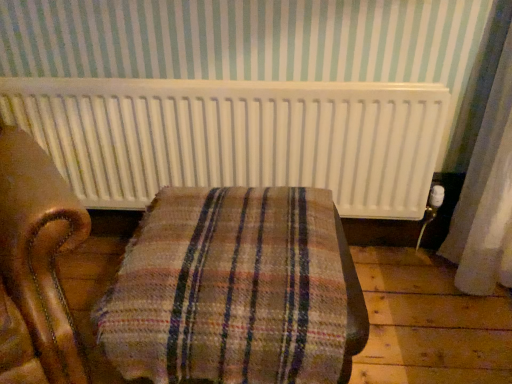
Question: In the image, is white matte radiator at upper center positioned in front of or behind plaid fabric ottoman at center?

Choices:
 (A) behind
 (B) front

Answer: (A)

Question: Is white matte radiator at upper center wider or thinner than plaid fabric ottoman at center?

Choices:
 (A) wide
 (B) thin

Answer: (B)

Question: Is white matte radiator at upper center taller or shorter than plaid fabric ottoman at center?

Choices:
 (A) short
 (B) tall

Answer: (A)

Question: Considering the positions of plaid fabric ottoman at center and white matte radiator at upper center in the image, is plaid fabric ottoman at center bigger or smaller than white matte radiator at upper center?

Choices:
 (A) big
 (B) small

Answer: (A)

Question: From a real-world perspective, is plaid fabric ottoman at center physically located above or below white matte radiator at upper center?

Choices:
 (A) above
 (B) below

Answer: (B)

Question: In terms of width, does plaid fabric ottoman at center look wider or thinner when compared to white matte radiator at upper center?

Choices:
 (A) thin
 (B) wide

Answer: (B)

Question: Choose the correct answer: Is plaid fabric ottoman at center inside white matte radiator at upper center or outside it?

Choices:
 (A) outside
 (B) inside

Answer: (A)